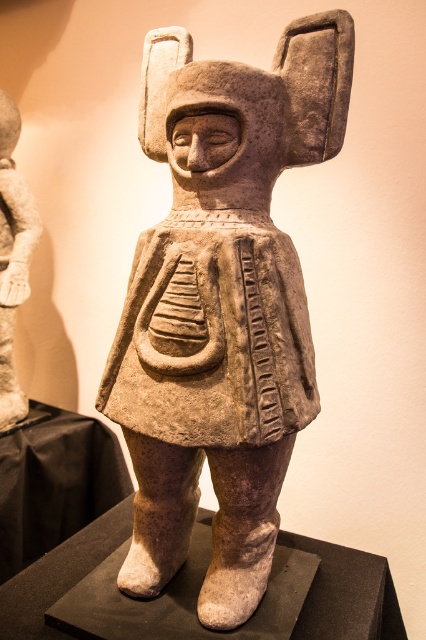
You are a photographer setting up a shot of the sculpture. You want to focus on the point at the headdress with coordinates point (261,422) and the point at the base of the sculpture with coordinates point (16,138). Which point should you adjust your focus to first if you want to ensure both are in sharp focus?

You should focus on point (16,138) first because it is farther from the camera than point (261,422). This way, you can adjust the focus starting from the farther point to ensure both are in sharp focus.

Based on the photo, you are a visitor at the museum holding a 1 meter long measuring tape. You want to measure the distance between yourself and the stone statue at center. Will the measuring tape be long enough to reach the statue?

The distance of stone statue at center from viewer is 1.01 meters, so the measuring tape is 1 meter long which is slightly shorter than the required distance. Therefore, the measuring tape will not be long enough to reach the statue.

You are an art conservator examining the stone sculpture in the museum. You notice a specific point at coordinates (221,305). Based on the sculpture description, where on the statue is this point located?

The point at coordinates (221,305) is on the stone statue at center, likely positioned on the central rounded design of the garment or the shield emblem described.